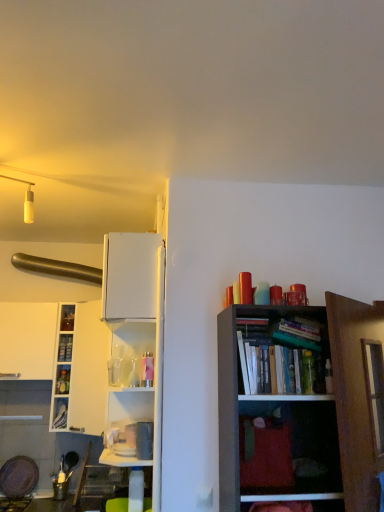
This screenshot has width=384, height=512. Describe the element at coordinates (60, 414) in the screenshot. I see `metallic blue cabinet at left, which is the 2th cabinet from top to bottom` at that location.

How much space does metallic blue cabinet at left, placed as the 1th cabinet when sorted from bottom to top, occupy vertically?

metallic blue cabinet at left, placed as the 1th cabinet when sorted from bottom to top, is 8.40 inches tall.

Locate an element on the screen. The width and height of the screenshot is (384, 512). white glossy cabinet at left, which is counted as the second cabinet, starting from the bottom is located at coordinates (63, 379).

What is the approximate height of hardcover book at upper right, the 2th book when ordered from left to right?

7.98 inches.

What do you see at coordinates (65, 348) in the screenshot?
I see `hardcover book at left, the 1th book positioned from the back` at bounding box center [65, 348].

Find the location of a particular element. The image size is (384, 512). white matte cabinet at left is located at coordinates (27, 340).

The width and height of the screenshot is (384, 512). I want to click on metallic blue cabinet at left, placed as the 1th cabinet when sorted from bottom to top, so tap(60, 414).

Is white glossy cabinet at left shorter than white matte cabinet at left?

In fact, white glossy cabinet at left may be taller than white matte cabinet at left.

Is white glossy cabinet at left in front of or behind white matte cabinet at left in the image?

white glossy cabinet at left is positioned closer to the viewer than white matte cabinet at left.

Image resolution: width=384 pixels, height=512 pixels. In order to click on cabinetry above the white glossy cabinet at left (from the image's perspective) in this screenshot , I will do `click(27, 340)`.

Can you confirm if white glossy cabinet at left is positioned to the right of white matte cabinet at left?

Yes.

Looking at the image, does white glossy cabinet at left, which is counted as the second cabinet, starting from the bottom, seem bigger or smaller compared to brushed metal exhaust hood at upper left?

white glossy cabinet at left, which is counted as the second cabinet, starting from the bottom, is smaller than brushed metal exhaust hood at upper left.

From the image's perspective, relative to brushed metal exhaust hood at upper left, is white glossy cabinet at left, the 1th cabinet when ordered from top to bottom, above or below?

white glossy cabinet at left, the 1th cabinet when ordered from top to bottom, is situated lower than brushed metal exhaust hood at upper left in the image.

In terms of height, does white glossy cabinet at left, which is counted as the second cabinet, starting from the bottom, look taller or shorter compared to brushed metal exhaust hood at upper left?

In the image, white glossy cabinet at left, which is counted as the second cabinet, starting from the bottom, appears to be shorter than brushed metal exhaust hood at upper left.

From the image's perspective, is white matte cabinet at left located above hardcover book at left, the 2th book viewed from the top?

Indeed, from the image's perspective, white matte cabinet at left is shown above hardcover book at left, the 2th book viewed from the top.

Is white matte cabinet at left not near hardcover book at left, the 1th book ordered from the bottom?

No, white matte cabinet at left is not far away from hardcover book at left, the 1th book ordered from the bottom.

From a real-world perspective, count 1st cabinets downward from the hardcover book at left, the 1th book ordered from the bottom, and point to it. Please provide its 2D coordinates.

[(63, 379)]

Is white glossy cabinet at left, the 1th cabinet when ordered from top to bottom, inside or outside of hardcover book at left, the 1th book ordered from the bottom?

The correct answer is: outside.

Is white glossy cabinet at left, the 1th cabinet when ordered from top to bottom, in contact with hardcover book at left, the 2th book viewed from the right?

No, white glossy cabinet at left, the 1th cabinet when ordered from top to bottom, is not in contact with hardcover book at left, the 2th book viewed from the right.

Is hardcover book at upper right, which is the second book in back-to-front order, positioned with its back to brushed metal exhaust hood at upper left?

No, brushed metal exhaust hood at upper left is not at the back of hardcover book at upper right, which is the second book in back-to-front order.

Who is shorter, hardcover book at upper right, marked as the 2th book in a bottom-to-top arrangement, or brushed metal exhaust hood at upper left?

Standing shorter between the two is hardcover book at upper right, marked as the 2th book in a bottom-to-top arrangement.

Between hardcover book at upper right, which is counted as the 1th book, starting from the right, and brushed metal exhaust hood at upper left, which one has smaller size?

Smaller between the two is hardcover book at upper right, which is counted as the 1th book, starting from the right.

What's the angular difference between hardcover book at upper right, which is the second book in back-to-front order, and brushed metal exhaust hood at upper left's facing directions?

They differ by 0.451 degrees in their facing directions.

From the picture: Considering the relative positions of hardcover book at upper right, marked as the 2th book in a bottom-to-top arrangement, and metallic blue cabinet at left, placed as the 1th cabinet when sorted from bottom to top, in the image provided, is hardcover book at upper right, marked as the 2th book in a bottom-to-top arrangement, to the right of metallic blue cabinet at left, placed as the 1th cabinet when sorted from bottom to top, from the viewer's perspective?

Correct, you'll find hardcover book at upper right, marked as the 2th book in a bottom-to-top arrangement, to the right of metallic blue cabinet at left, placed as the 1th cabinet when sorted from bottom to top.

Who is bigger, hardcover book at upper right, which is counted as the 1th book, starting from the right, or metallic blue cabinet at left, placed as the 1th cabinet when sorted from bottom to top?

Bigger between the two is hardcover book at upper right, which is counted as the 1th book, starting from the right.

Is hardcover book at upper right, which is the second book in back-to-front order, surrounding metallic blue cabinet at left, placed as the 1th cabinet when sorted from bottom to top?

No, metallic blue cabinet at left, placed as the 1th cabinet when sorted from bottom to top, is not surrounded by hardcover book at upper right, which is the second book in back-to-front order.

From the image's perspective, starting from the brushed metal exhaust hood at upper left, which book is the 2nd one below? Please provide its 2D coordinates.

[(65, 348)]

From the image's perspective, is hardcover book at left, the 1th book positioned from the back, positioned above or below brushed metal exhaust hood at upper left?

From the image's perspective, hardcover book at left, the 1th book positioned from the back, appears below brushed metal exhaust hood at upper left.

Could you tell me if hardcover book at left, the 1th book positioned from the back, is facing brushed metal exhaust hood at upper left?

No, hardcover book at left, the 1th book positioned from the back, is not aimed at brushed metal exhaust hood at upper left.

Which point is more forward, [61,354] or [65,269]?

The point [61,354] is closer to the camera.

The height and width of the screenshot is (512, 384). Identify the location of cabinetry on the left side of white glossy cabinet at left. (27, 340).

Starting from the brushed metal exhaust hood at upper left, which cabinet is the 1st one in front? Please provide its 2D coordinates.

[(63, 379)]

Which object lies nearer to the anchor point metallic blue cabinet at left, which is the 2th cabinet from top to bottom, white matte cabinet at left or hardcover book at upper right, the 2th book when ordered from left to right?

white matte cabinet at left is positioned closer to the anchor metallic blue cabinet at left, which is the 2th cabinet from top to bottom.

Based on their spatial positions, is hardcover book at upper right, which is counted as the 1th book, starting from the right, or white glossy cabinet at left closer to brushed metal exhaust hood at upper left?

white glossy cabinet at left.

From the image, which object appears to be farther from white glossy cabinet at left, which is counted as the second cabinet, starting from the bottom, white glossy cabinet at left or brushed metal exhaust hood at upper left?

brushed metal exhaust hood at upper left is positioned further to the anchor white glossy cabinet at left, which is counted as the second cabinet, starting from the bottom.

Which object lies further to the anchor point white matte cabinet at left, white glossy cabinet at left or brushed metal exhaust hood at upper left?

Among the two, brushed metal exhaust hood at upper left is located further to white matte cabinet at left.

Which object lies further to the anchor point hardcover book at upper right, which ranks as the first book in front-to-back order, white matte cabinet at left or hardcover book at left, the 1th book ordered from the bottom?

Based on the image, white matte cabinet at left appears to be further to hardcover book at upper right, which ranks as the first book in front-to-back order.

Based on their spatial positions, is brushed metal exhaust hood at upper left or white glossy cabinet at left, the 1th cabinet when ordered from top to bottom, further from white glossy cabinet at left?

The object further to white glossy cabinet at left is brushed metal exhaust hood at upper left.

Based on their spatial positions, is metallic blue cabinet at left, placed as the 1th cabinet when sorted from bottom to top, or hardcover book at upper right, the 1th book in the top-to-bottom sequence, further from white matte cabinet at left?

hardcover book at upper right, the 1th book in the top-to-bottom sequence, is positioned further to the anchor white matte cabinet at left.

Which object lies further to the anchor point brushed metal exhaust hood at upper left, hardcover book at left, acting as the second book starting from the front, or white glossy cabinet at left, the 1th cabinet when ordered from top to bottom?

Based on the image, white glossy cabinet at left, the 1th cabinet when ordered from top to bottom, appears to be further to brushed metal exhaust hood at upper left.

The width and height of the screenshot is (384, 512). What are the coordinates of `cabinetry between brushed metal exhaust hood at upper left and white glossy cabinet at left from top to bottom` in the screenshot? It's located at pyautogui.click(x=27, y=340).

Locate an element on the screen. This screenshot has width=384, height=512. book located between metallic blue cabinet at left, placed as the 1th cabinet when sorted from bottom to top, and hardcover book at upper right, which is counted as the 1th book, starting from the right, in the left-right direction is located at coordinates (65, 348).

At what (x,y) coordinates should I click in order to perform the action: click on cabinet between hardcover book at left, the 2th book viewed from the top, and metallic blue cabinet at left, placed as the 1th cabinet when sorted from bottom to top, from top to bottom. Please return your answer as a coordinate pair (x, y). This screenshot has width=384, height=512. Looking at the image, I should click on (63, 379).

At what (x,y) coordinates should I click in order to perform the action: click on cabinet between metallic blue cabinet at left, which is the 2th cabinet from top to bottom, and hardcover book at upper right, which is counted as the 1th book, starting from the right, in the horizontal direction. Please return your answer as a coordinate pair (x, y). Image resolution: width=384 pixels, height=512 pixels. Looking at the image, I should click on [63, 379].